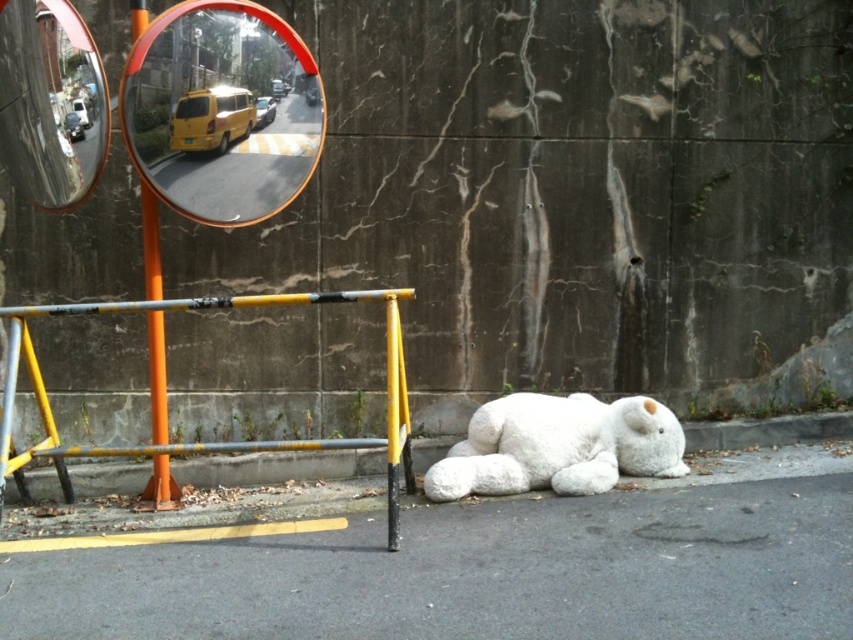
Question: Which point is farther to the camera?

Choices:
 (A) (616, 403)
 (B) (216, 140)

Answer: (A)

Question: Which object appears closest to the camera in this image?

Choices:
 (A) orange reflective convex mirror at upper left
 (B) orange plastic pole at left

Answer: (A)

Question: Can you confirm if gray asphalt at lower center is positioned above orange plastic pole at left?

Choices:
 (A) no
 (B) yes

Answer: (A)

Question: Which object is closer to the camera taking this photo?

Choices:
 (A) gray asphalt at lower center
 (B) metallic mirror at upper left

Answer: (A)

Question: Does white plush bear at lower right have a lesser width compared to orange plastic pole at left?

Choices:
 (A) yes
 (B) no

Answer: (B)

Question: From the image, what is the correct spatial relationship of yellow metal barricade at lower center in relation to orange plastic pole at left?

Choices:
 (A) above
 (B) below

Answer: (B)